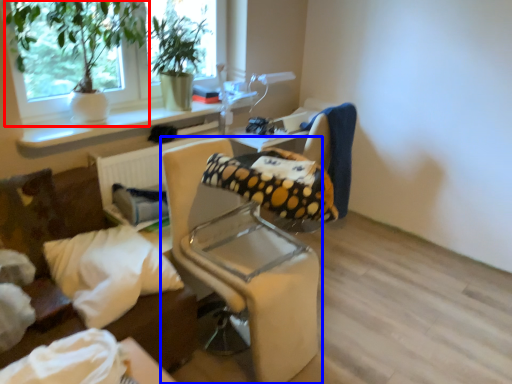
Question: Which object is closer to the camera taking this photo, houseplant (highlighted by a red box) or chair (highlighted by a blue box)?

Choices:
 (A) houseplant
 (B) chair

Answer: (B)